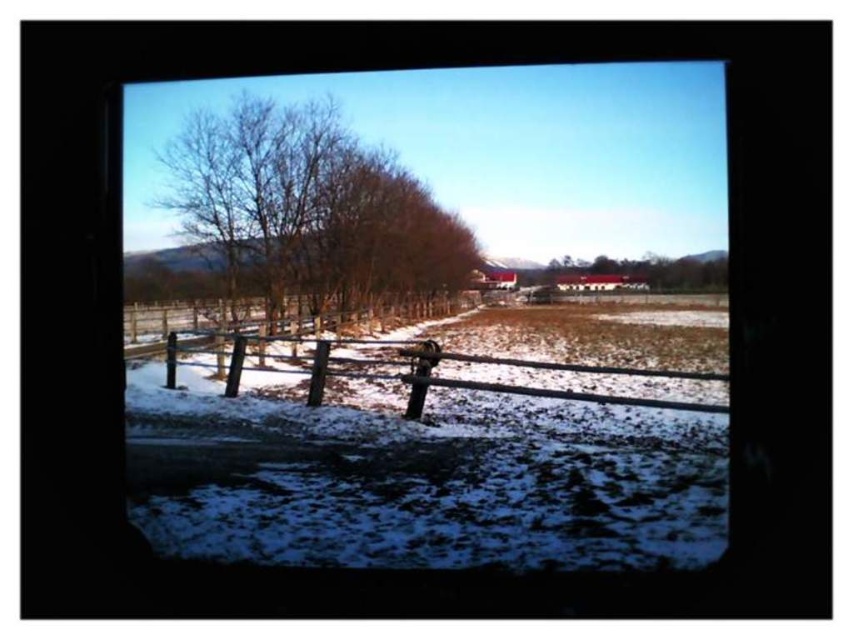
You are standing in a room looking through a window. You see a wooden fence at center and a brown wood tree at center. Which object is closer to you?

The wooden fence at center is closer to you because it is in front of the brown wood tree at center.

You are standing inside a room looking through a window. You see a brown leafless tree at center and a wooden fence at center. Which object is closer to you?

The wooden fence at center is closer to you because the brown leafless tree at center is located above it, meaning the fence is in front of the tree in the scene.